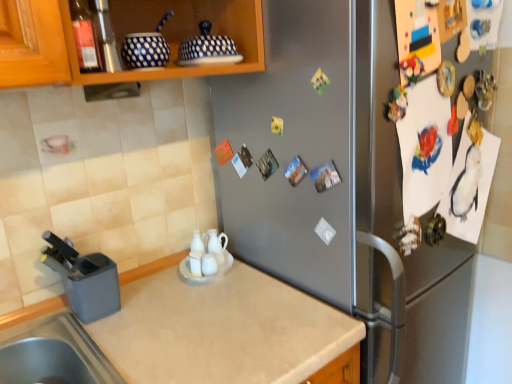
Question: Does translucent glass bottle at upper left have a smaller size compared to gray plastic knife block at lower left, positioned as the third appliance in right-to-left order?

Choices:
 (A) yes
 (B) no

Answer: (A)

Question: Is translucent glass bottle at upper left not close to gray plastic knife block at lower left, which is the 1th appliance from left to right?

Choices:
 (A) no
 (B) yes

Answer: (A)

Question: From a real-world perspective, is translucent glass bottle at upper left beneath gray plastic knife block at lower left, which is the third appliance from top to bottom?

Choices:
 (A) yes
 (B) no

Answer: (B)

Question: Is translucent glass bottle at upper left bigger than gray plastic knife block at lower left, positioned as the third appliance in right-to-left order?

Choices:
 (A) yes
 (B) no

Answer: (B)

Question: Is translucent glass bottle at upper left positioned behind gray plastic knife block at lower left, the first appliance in the bottom-to-top sequence?

Choices:
 (A) yes
 (B) no

Answer: (B)

Question: Can you confirm if translucent glass bottle at upper left is positioned to the right of gray plastic knife block at lower left, which is the 1th appliance from left to right?

Choices:
 (A) yes
 (B) no

Answer: (A)

Question: Can you confirm if beige laminate countertop at lower left is taller than gray plastic knife block at lower left, the first appliance in the bottom-to-top sequence?

Choices:
 (A) yes
 (B) no

Answer: (A)

Question: Is beige laminate countertop at lower left not near gray plastic knife block at lower left, the first appliance in the bottom-to-top sequence?

Choices:
 (A) yes
 (B) no

Answer: (B)

Question: Does beige laminate countertop at lower left have a smaller size compared to gray plastic knife block at lower left, the first appliance in the bottom-to-top sequence?

Choices:
 (A) no
 (B) yes

Answer: (A)

Question: From the image's perspective, is beige laminate countertop at lower left on top of gray plastic knife block at lower left, the first appliance in the bottom-to-top sequence?

Choices:
 (A) yes
 (B) no

Answer: (B)

Question: Can you confirm if beige laminate countertop at lower left is positioned to the right of gray plastic knife block at lower left, which is the third appliance from top to bottom?

Choices:
 (A) yes
 (B) no

Answer: (A)

Question: Can you confirm if beige laminate countertop at lower left is positioned to the left of gray plastic knife block at lower left, positioned as the third appliance in right-to-left order?

Choices:
 (A) yes
 (B) no

Answer: (B)

Question: From a real-world perspective, is gray plastic knife block at lower left, the first appliance in the bottom-to-top sequence, over beige laminate countertop at lower left?

Choices:
 (A) yes
 (B) no

Answer: (A)